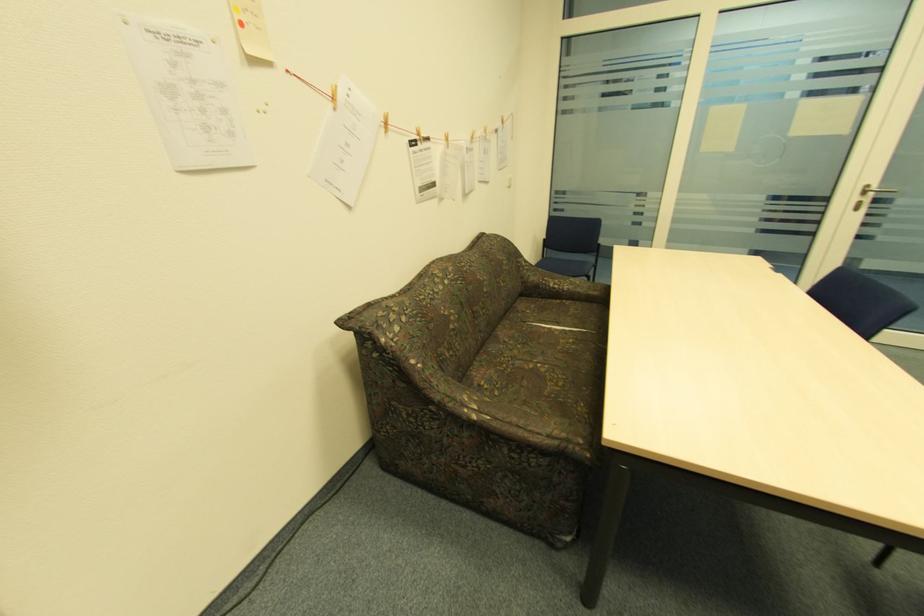
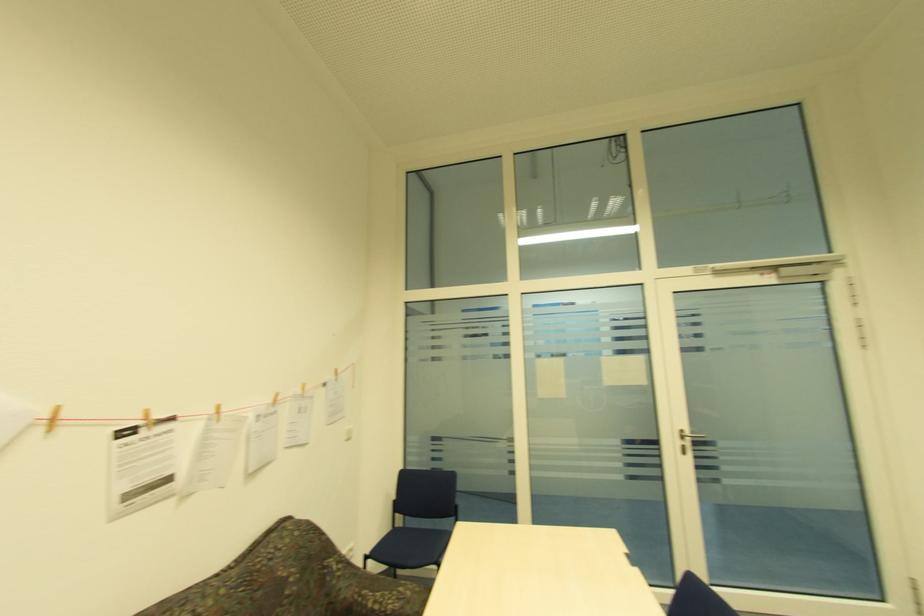
The point at (870, 187) is marked in the first image. Where is the corresponding point in the second image?

(685, 432)